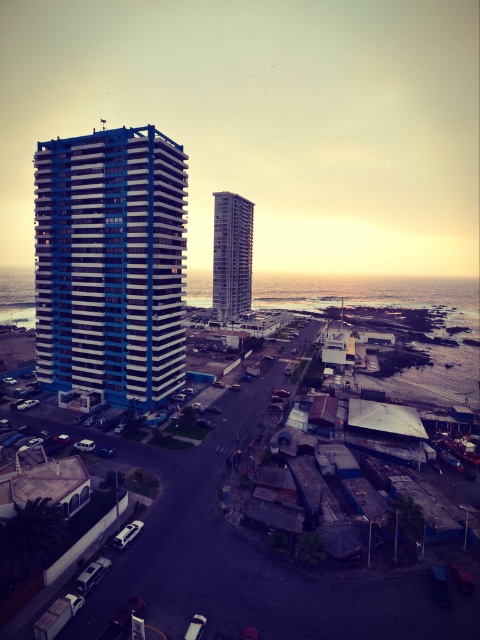
Question: Does blue glossy building at center appear on the right side of smooth glass building at center?

Choices:
 (A) yes
 (B) no

Answer: (B)

Question: Where is blue glossy building at center located in relation to smooth glass building at center in the image?

Choices:
 (A) left
 (B) right

Answer: (A)

Question: In this image, where is blue glossy building at center located relative to smooth glass building at center?

Choices:
 (A) below
 (B) above

Answer: (A)

Question: Which object is closer to the camera taking this photo?

Choices:
 (A) smooth glass building at center
 (B) blue glossy building at center

Answer: (B)